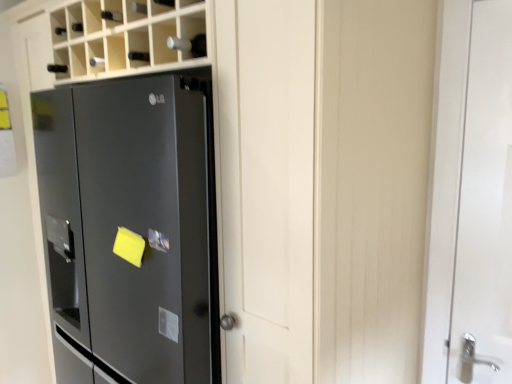
Question: Can you confirm if white glossy door at right is bigger than satin black refrigerator at left?

Choices:
 (A) yes
 (B) no

Answer: (B)

Question: Can you confirm if white glossy door at right is wider than satin black refrigerator at left?

Choices:
 (A) no
 (B) yes

Answer: (A)

Question: Is white glossy door at right facing away from satin black refrigerator at left?

Choices:
 (A) no
 (B) yes

Answer: (A)

Question: Is white glossy door at right at the left side of satin black refrigerator at left?

Choices:
 (A) no
 (B) yes

Answer: (A)

Question: Is white glossy door at right shorter than satin black refrigerator at left?

Choices:
 (A) yes
 (B) no

Answer: (A)

Question: Is white glossy door at right at the right side of satin black refrigerator at left?

Choices:
 (A) no
 (B) yes

Answer: (B)

Question: Can you see satin black refrigerator at left touching white glossy door at right?

Choices:
 (A) no
 (B) yes

Answer: (A)

Question: Is satin black refrigerator at left positioned with its back to white glossy door at right?

Choices:
 (A) yes
 (B) no

Answer: (B)

Question: From a real-world perspective, is satin black refrigerator at left physically above white glossy door at right?

Choices:
 (A) no
 (B) yes

Answer: (A)

Question: Can you confirm if satin black refrigerator at left is positioned to the right of white glossy door at right?

Choices:
 (A) yes
 (B) no

Answer: (B)

Question: Is satin black refrigerator at left to the left of white glossy door at right from the viewer's perspective?

Choices:
 (A) yes
 (B) no

Answer: (A)

Question: Is satin black refrigerator at left shorter than white glossy door at right?

Choices:
 (A) yes
 (B) no

Answer: (B)

Question: Is white glossy door at right taller or shorter than satin black refrigerator at left?

Choices:
 (A) short
 (B) tall

Answer: (A)